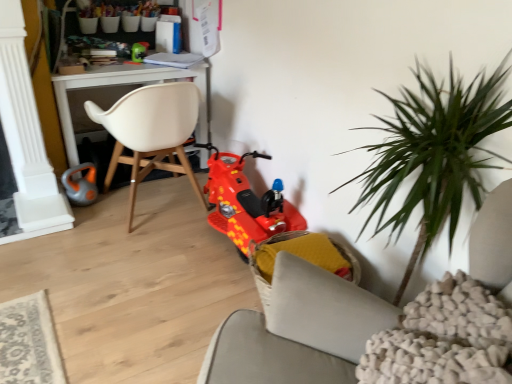
This screenshot has width=512, height=384. Identify the location of vacant region below white matte chair at center, which is the 2th chair from right to left (from a real-world perspective). (161, 207).